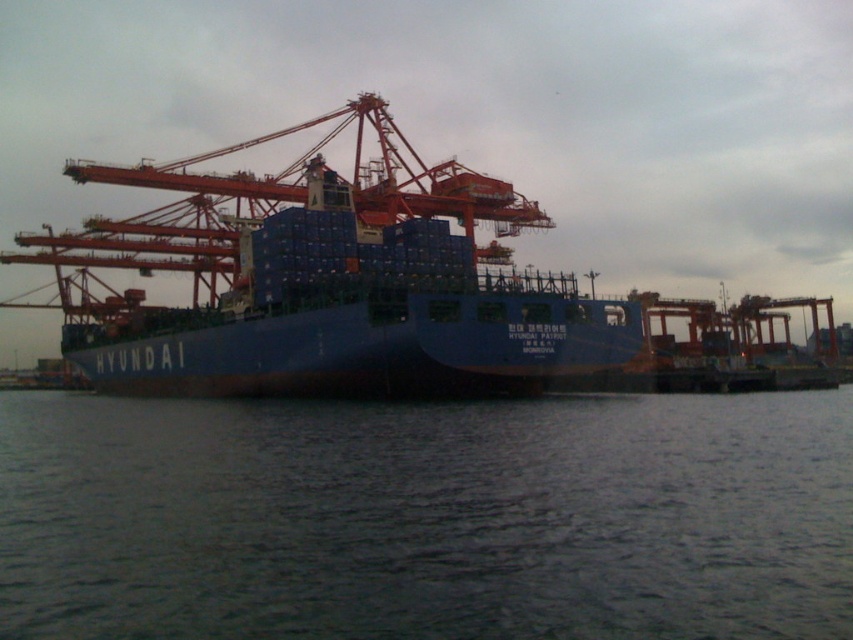
Does dark gray water at center come behind metallic orange crane at center?

That is False.

Which is in front, point (657, 529) or point (192, 268)?

Point (657, 529)

Locate an element on the screen. dark gray water at center is located at coordinates (427, 518).

Consider the image. Between blue matte container ship at center and metallic orange crane at center, which one has less height?

With less height is blue matte container ship at center.

Is blue matte container ship at center wider than metallic orange crane at center?

No, blue matte container ship at center is not wider than metallic orange crane at center.

Is point (521, 284) closer to viewer compared to point (199, 250)?

Yes, point (521, 284) is closer to viewer.

Where is `blue matte container ship at center`? The width and height of the screenshot is (853, 640). blue matte container ship at center is located at coordinates (357, 317).

Between dark gray water at center and blue matte container ship at center, which one has more height?

blue matte container ship at center is taller.

Does dark gray water at center appear over blue matte container ship at center?

Actually, dark gray water at center is below blue matte container ship at center.

The height and width of the screenshot is (640, 853). Describe the element at coordinates (427, 518) in the screenshot. I see `dark gray water at center` at that location.

This screenshot has width=853, height=640. I want to click on dark gray water at center, so click(427, 518).